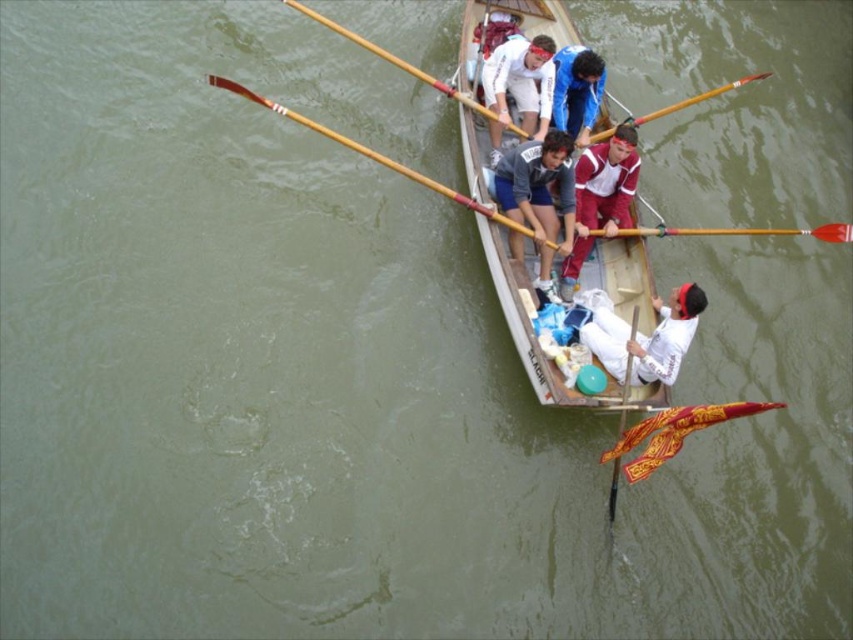
Is point (544, 124) more distant than point (621, 230)?

Yes, point (544, 124) is behind point (621, 230).

Is white cotton shirt at center to the right of wooden polished paddle at center from the viewer's perspective?

No, white cotton shirt at center is not to the right of wooden polished paddle at center.

Is point (538, 118) positioned in front of point (761, 234)?

Yes, point (538, 118) is closer to viewer.

This screenshot has height=640, width=853. Identify the location of white cotton shirt at center. (519, 84).

Based on the photo, does wooden paddle at upper center appear on the right side of wooden polished oar at upper center?

Incorrect, wooden paddle at upper center is not on the right side of wooden polished oar at upper center.

Can you confirm if wooden paddle at upper center is wider than wooden polished oar at upper center?

Yes, wooden paddle at upper center is wider than wooden polished oar at upper center.

This screenshot has width=853, height=640. In order to click on wooden paddle at upper center in this screenshot , I will do `click(408, 68)`.

Where is `wooden paddle at upper center`? This screenshot has width=853, height=640. wooden paddle at upper center is located at coordinates (408, 68).

Is wooden polished oar at center smaller than wooden polished paddle at lower center?

No, wooden polished oar at center is not smaller than wooden polished paddle at lower center.

Between point (299, 116) and point (607, 502), which one is positioned in front?

Point (607, 502)

Where is `wooden polished oar at center`? The image size is (853, 640). wooden polished oar at center is located at coordinates (386, 163).